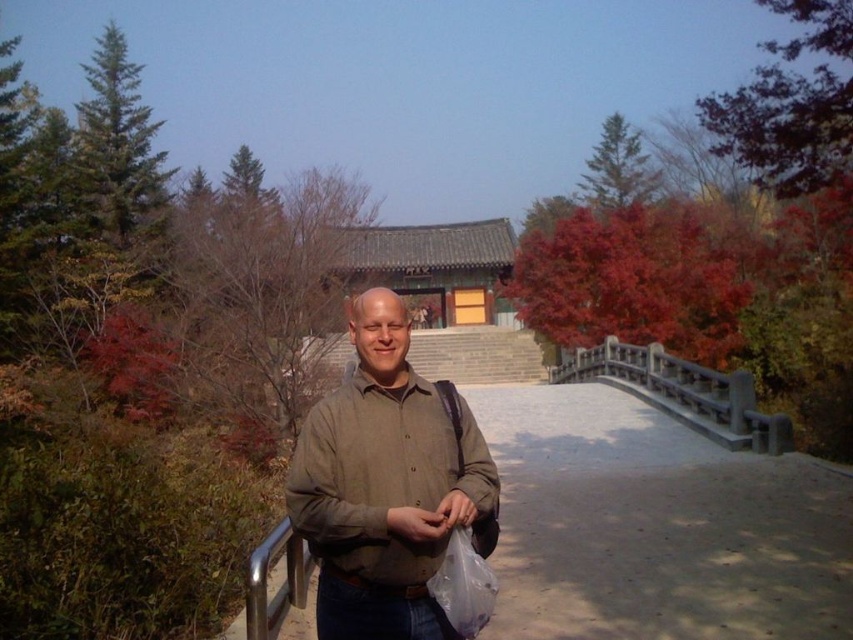
How distant is black stone bridge at center from silver metallic handrail at lower left?

They are 9.56 meters apart.

Which is above, black stone bridge at center or silver metallic handrail at lower left?

Positioned higher is black stone bridge at center.

What do you see at coordinates (682, 392) in the screenshot? I see `black stone bridge at center` at bounding box center [682, 392].

I want to click on black stone bridge at center, so click(x=682, y=392).

Does black stone bridge at center appear on the left side of translucent plastic bag at lower center?

No, black stone bridge at center is not to the left of translucent plastic bag at lower center.

Does black stone bridge at center appear on the right side of translucent plastic bag at lower center?

Indeed, black stone bridge at center is positioned on the right side of translucent plastic bag at lower center.

This screenshot has width=853, height=640. What do you see at coordinates (682, 392) in the screenshot?
I see `black stone bridge at center` at bounding box center [682, 392].

You are a GUI agent. You are given a task and a screenshot of the screen. Output one action in this format:
    pyautogui.click(x=<x>, y=<y>)
    Task: Click on the black stone bridge at center
    The width and height of the screenshot is (853, 640).
    Given the screenshot: What is the action you would take?
    pyautogui.click(x=682, y=392)

Which is below, matte brown hand at center or translucent plastic bag at lower center?

matte brown hand at center is below.

Can you confirm if matte brown hand at center is shorter than translucent plastic bag at lower center?

No, matte brown hand at center is not shorter than translucent plastic bag at lower center.

Is point (415, 538) in front of point (444, 506)?

Yes.

You are a GUI agent. You are given a task and a screenshot of the screen. Output one action in this format:
    pyautogui.click(x=<x>, y=<y>)
    Task: Click on the matte brown hand at center
    This screenshot has width=853, height=640.
    Given the screenshot: What is the action you would take?
    pyautogui.click(x=416, y=524)